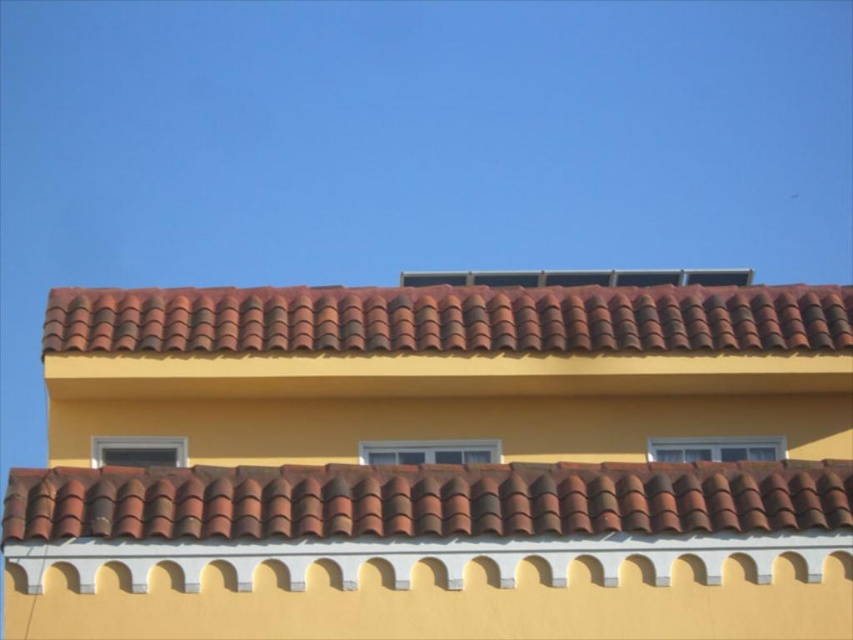
Does brown clay tiles at center have a larger size compared to brown clay tiles at top?

No.

Who is more forward, (427, 470) or (51, 292)?

Point (427, 470) is in front.

I want to click on brown clay tiles at center, so click(425, 500).